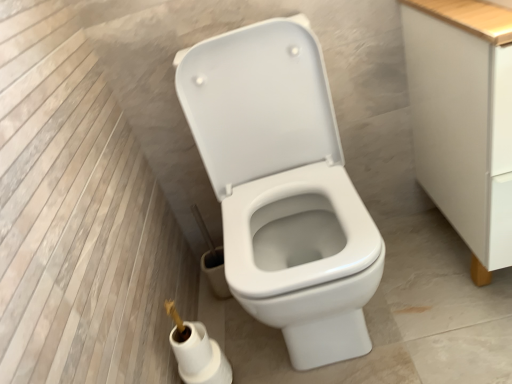
Question: Can you confirm if white glossy toilet at center is smaller than white matte cabinet at right?

Choices:
 (A) yes
 (B) no

Answer: (B)

Question: Considering the relative sizes of white glossy toilet at center and white matte cabinet at right in the image provided, is white glossy toilet at center taller than white matte cabinet at right?

Choices:
 (A) yes
 (B) no

Answer: (A)

Question: From a real-world perspective, is white glossy toilet at center on white matte cabinet at right?

Choices:
 (A) no
 (B) yes

Answer: (B)

Question: Does white glossy toilet at center have a larger size compared to white matte cabinet at right?

Choices:
 (A) no
 (B) yes

Answer: (B)

Question: From a real-world perspective, is white glossy toilet at center physically below white matte cabinet at right?

Choices:
 (A) yes
 (B) no

Answer: (B)

Question: Can you confirm if white glossy toilet at center is shorter than white matte cabinet at right?

Choices:
 (A) no
 (B) yes

Answer: (A)

Question: Is white matte cabinet at right positioned before white glossy toilet at center?

Choices:
 (A) yes
 (B) no

Answer: (B)

Question: From the image's perspective, is white matte cabinet at right located above white glossy toilet at center?

Choices:
 (A) yes
 (B) no

Answer: (A)

Question: Can we say white matte cabinet at right lies outside white glossy toilet at center?

Choices:
 (A) yes
 (B) no

Answer: (A)

Question: Is white matte cabinet at right oriented towards white glossy toilet at center?

Choices:
 (A) yes
 (B) no

Answer: (B)

Question: Is white matte cabinet at right oriented away from white glossy toilet at center?

Choices:
 (A) no
 (B) yes

Answer: (A)

Question: Is the depth of white matte cabinet at right greater than that of white glossy toilet at center?

Choices:
 (A) yes
 (B) no

Answer: (A)

Question: Would you consider white matte toilet paper at lower center to be distant from white glossy toilet at center?

Choices:
 (A) yes
 (B) no

Answer: (B)